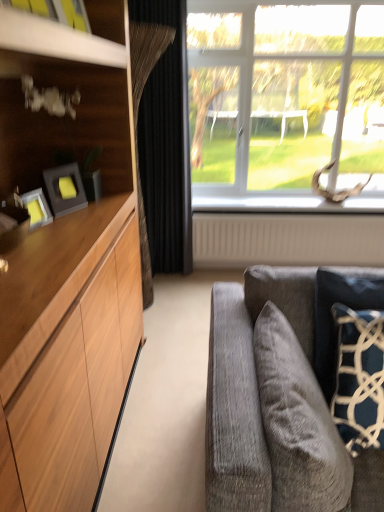
Question: Considering the relative sizes of dark blue textured pillow at right, which appears as the 2th pillow when viewed from the left, and velvet gray pillow at lower right, the second pillow from the right, in the image provided, is dark blue textured pillow at right, which appears as the 2th pillow when viewed from the left, smaller than velvet gray pillow at lower right, the second pillow from the right,?

Choices:
 (A) yes
 (B) no

Answer: (A)

Question: From a real-world perspective, does dark blue textured pillow at right, which is counted as the first pillow, starting from the right, stand above velvet gray pillow at lower right, the second pillow from the right?

Choices:
 (A) no
 (B) yes

Answer: (B)

Question: Considering the relative positions of dark blue textured pillow at right, which appears as the 2th pillow when viewed from the left, and velvet gray pillow at lower right, the second pillow from the right, in the image provided, is dark blue textured pillow at right, which appears as the 2th pillow when viewed from the left, to the left of velvet gray pillow at lower right, the second pillow from the right, from the viewer's perspective?

Choices:
 (A) yes
 (B) no

Answer: (B)

Question: Is there a large distance between dark blue textured pillow at right, which appears as the 2th pillow when viewed from the left, and velvet gray pillow at lower right, the second pillow from the right?

Choices:
 (A) no
 (B) yes

Answer: (A)

Question: Does dark blue textured pillow at right, which is counted as the first pillow, starting from the right, have a lesser height compared to velvet gray pillow at lower right, the second pillow from the right?

Choices:
 (A) yes
 (B) no

Answer: (B)

Question: From a real-world perspective, is clear glass window at upper right physically located above or below beige textured radiator at lower center?

Choices:
 (A) below
 (B) above

Answer: (B)

Question: Is clear glass window at upper right in front of or behind beige textured radiator at lower center in the image?

Choices:
 (A) behind
 (B) front

Answer: (B)

Question: Is point (377, 184) closer or farther from the camera than point (289, 231)?

Choices:
 (A) closer
 (B) farther

Answer: (B)

Question: Is clear glass window at upper right bigger or smaller than beige textured radiator at lower center?

Choices:
 (A) small
 (B) big

Answer: (B)

Question: Considering their positions, is velvet gray pillow at lower right, which is counted as the 1th pillow, starting from the left, located in front of or behind matte black picture frame at left?

Choices:
 (A) behind
 (B) front

Answer: (B)

Question: Is velvet gray pillow at lower right, the second pillow from the right, to the left or to the right of matte black picture frame at left in the image?

Choices:
 (A) right
 (B) left

Answer: (A)

Question: Is velvet gray pillow at lower right, the second pillow from the right, situated inside matte black picture frame at left or outside?

Choices:
 (A) inside
 (B) outside

Answer: (B)

Question: Is point (319, 475) closer or farther from the camera than point (46, 186)?

Choices:
 (A) farther
 (B) closer

Answer: (B)

Question: Is velvet gray pillow at lower right, which is counted as the 1th pillow, starting from the left, bigger or smaller than black velvet curtain at center?

Choices:
 (A) small
 (B) big

Answer: (A)

Question: Is velvet gray pillow at lower right, which is counted as the 1th pillow, starting from the left, wider or thinner than black velvet curtain at center?

Choices:
 (A) thin
 (B) wide

Answer: (B)